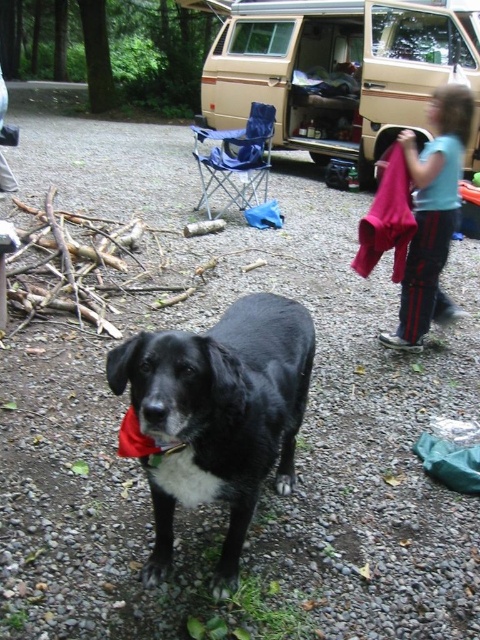
The image size is (480, 640). Describe the element at coordinates (342, 72) in the screenshot. I see `beige fabric van at center` at that location.

Locate an element on the screen. This screenshot has width=480, height=640. beige fabric van at center is located at coordinates (342, 72).

Is black matte dog at center below blue cotton shirt at upper right?

Indeed, black matte dog at center is positioned under blue cotton shirt at upper right.

Which is below, black matte dog at center or blue cotton shirt at upper right?

black matte dog at center

What do you see at coordinates (218, 413) in the screenshot?
I see `black matte dog at center` at bounding box center [218, 413].

Find the location of a particular element. The height and width of the screenshot is (640, 480). black matte dog at center is located at coordinates tap(218, 413).

Can you confirm if blue cotton shirt at upper right is thinner than red fabric neckband at center?

Incorrect, blue cotton shirt at upper right's width is not less than red fabric neckband at center's.

In the scene shown: Can you confirm if blue cotton shirt at upper right is smaller than red fabric neckband at center?

Actually, blue cotton shirt at upper right might be larger than red fabric neckband at center.

Between point (428, 243) and point (168, 448), which one is positioned behind?

The point (428, 243) is more distant.

At what (x,y) coordinates should I click in order to perform the action: click on blue cotton shirt at upper right. Please return your answer as a coordinate pair (x, y). Looking at the image, I should click on (432, 214).